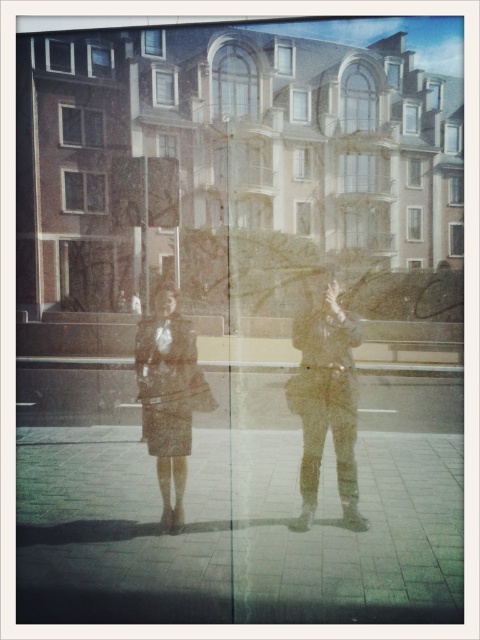
You are standing on the smooth concrete pavement at lower center and want to place the matte black jacket at center on it. Can you determine if the jacket will fit entirely on the pavement?

The smooth concrete pavement at lower center is wider than the matte black jacket at center, so the jacket will fit entirely on the pavement.